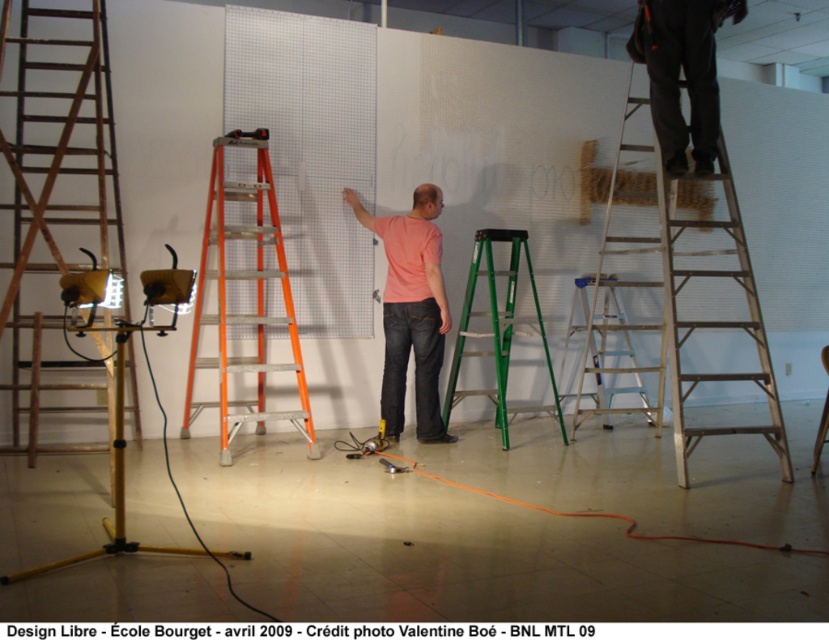
Question: Which of these objects is positioned farthest from the metallic silver ladder at center?

Choices:
 (A) wooden ladder at left
 (B) orange aluminum ladder at center-left
 (C) dark gray pants at upper right

Answer: (A)

Question: Which object is the farthest from the dark gray pants at upper right?

Choices:
 (A) green plastic ladder at center
 (B) pink matte shirt at center
 (C) orange aluminum ladder at center-left

Answer: (C)

Question: Considering the relative positions of dark gray pants at upper right and metallic silver ladder at center in the image provided, where is dark gray pants at upper right located with respect to metallic silver ladder at center?

Choices:
 (A) right
 (B) left

Answer: (A)

Question: Is wooden ladder at left closer to camera compared to wooden stool at center?

Choices:
 (A) yes
 (B) no

Answer: (A)

Question: Is orange aluminum ladder at center-left below dark gray pants at upper right?

Choices:
 (A) yes
 (B) no

Answer: (A)

Question: Which of these objects is positioned farthest from the metallic silver ladder at center?

Choices:
 (A) pink matte shirt at center
 (B) green plastic ladder at center
 (C) wooden ladder at left
 (D) dark gray pants at upper right

Answer: (C)